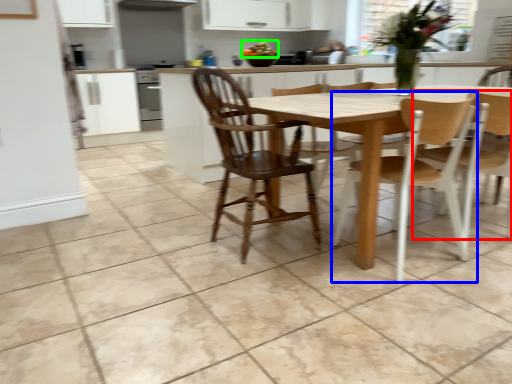
Question: Which object is the farthest from chair (highlighted by a red box)? Choose among these: chair (highlighted by a blue box) or food (highlighted by a green box).

Choices:
 (A) chair
 (B) food

Answer: (B)